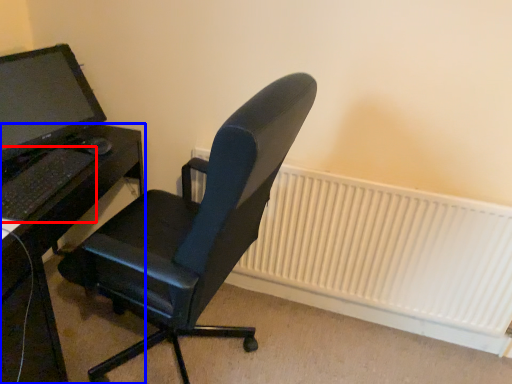
Question: Which object appears farthest to the camera in this image, computer keyboard (highlighted by a red box) or desk (highlighted by a blue box)?

Choices:
 (A) computer keyboard
 (B) desk

Answer: (A)